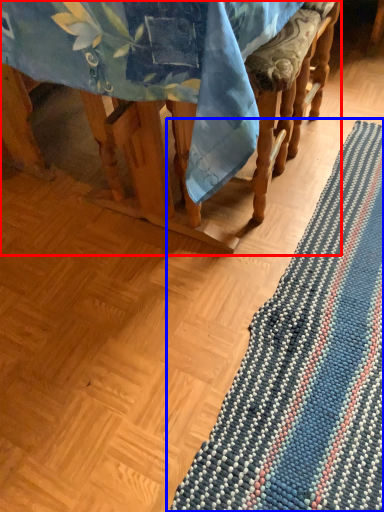
Question: Among these objects, which one is nearest to the camera, furniture (highlighted by a red box) or mat (highlighted by a blue box)?

Choices:
 (A) furniture
 (B) mat

Answer: (A)